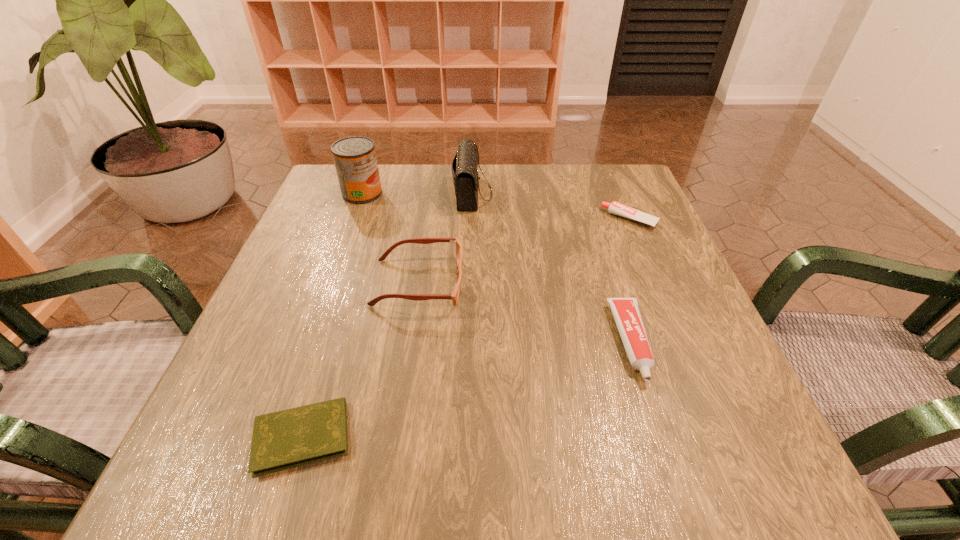
The width and height of the screenshot is (960, 540). I want to click on free spot at the far right corner of the desktop, so pyautogui.click(x=589, y=177).

Find the location of a particular element. The width and height of the screenshot is (960, 540). vacant space at the near right corner of the desktop is located at coordinates point(689,446).

Identify the location of vacant area between the fifth shortest object and the third tallest object. The width and height of the screenshot is (960, 540). (445, 238).

Where is `vacant area between the clutch bag and the nearest object`? The height and width of the screenshot is (540, 960). vacant area between the clutch bag and the nearest object is located at coordinates (388, 315).

At what (x,y) coordinates should I click in order to perform the action: click on vacant space that's between the third tallest object and the can. Please return your answer as a coordinate pair (x, y). The width and height of the screenshot is (960, 540). Looking at the image, I should click on (391, 238).

This screenshot has height=540, width=960. Identify the location of unoccupied position between the can and the third tallest object. (391, 238).

Identify the location of vacant area that lies between the shorter toothpaste and the shortest object. (467, 328).

The height and width of the screenshot is (540, 960). I want to click on vacant point located between the diary and the spectacles, so click(x=360, y=360).

Where is `vacant space in between the spectacles and the second shortest object`? The image size is (960, 540). vacant space in between the spectacles and the second shortest object is located at coordinates tap(524, 251).

The width and height of the screenshot is (960, 540). What are the coordinates of `unoccupied area between the farther toothpaste and the second tallest object` in the screenshot? It's located at (551, 206).